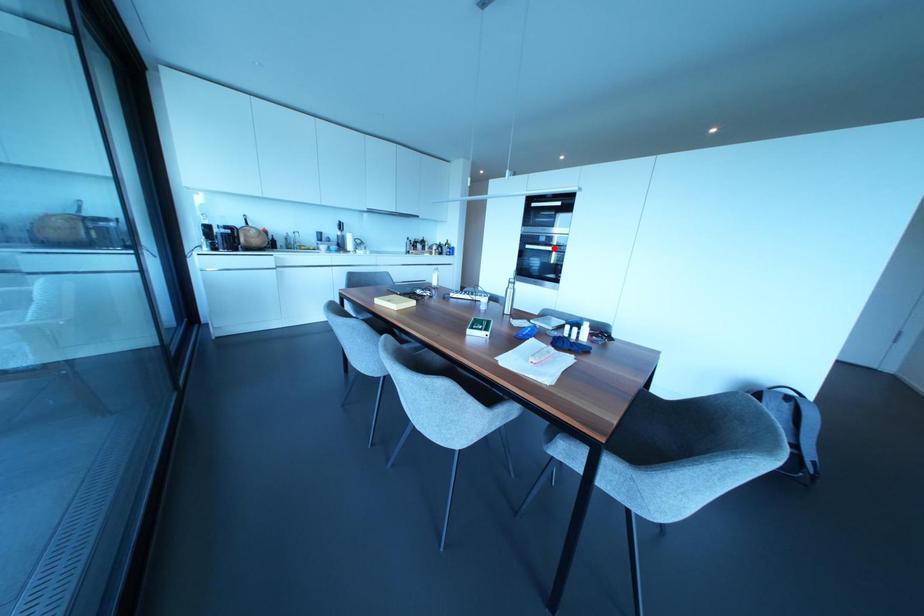
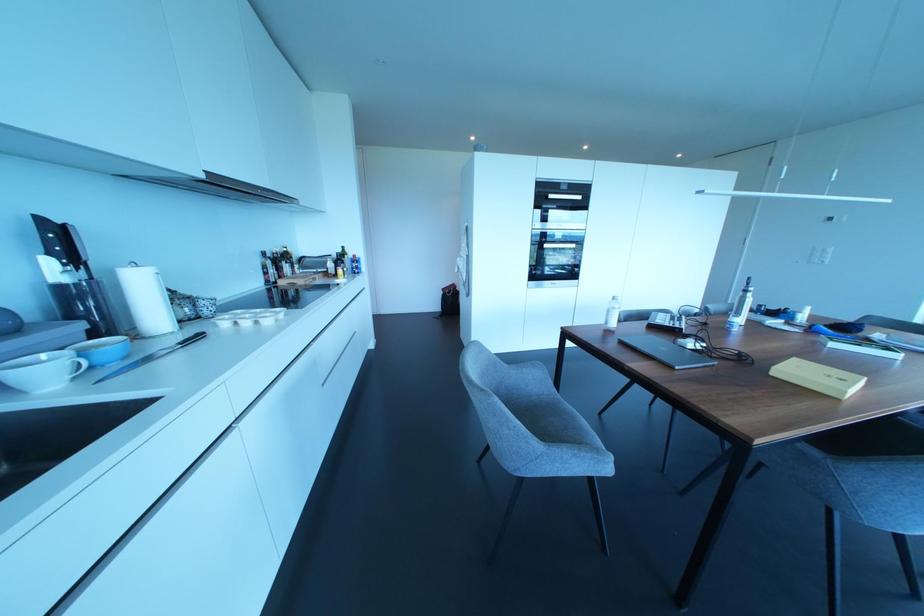
The point at the highlighted location is marked in the first image. Where is the corresponding point in the second image?

(573, 246)